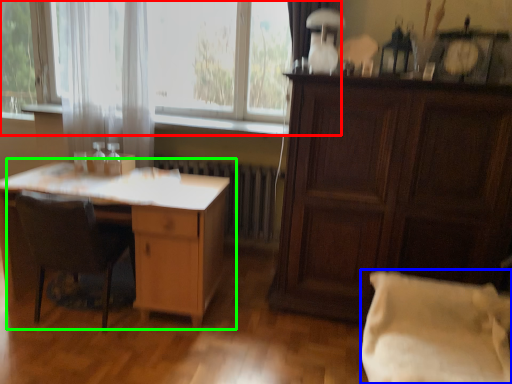
Question: Which is nearer to the window (highlighted by a red box)? pillow (highlighted by a blue box) or desk (highlighted by a green box).

Choices:
 (A) pillow
 (B) desk

Answer: (B)